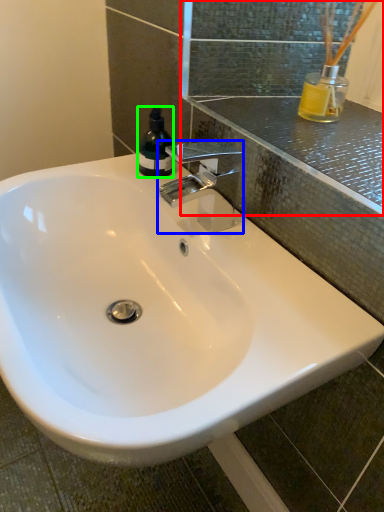
Question: Which is nearer to the mirror (highlighted by a red box)? tap (highlighted by a blue box) or bottle (highlighted by a green box).

Choices:
 (A) tap
 (B) bottle

Answer: (A)